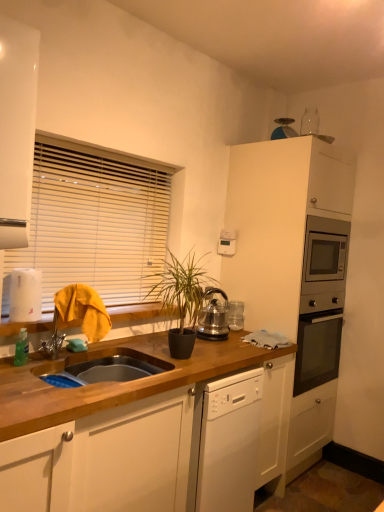
At what (x,y) coordinates should I click in order to perform the action: click on vacant space to the right of polished stainless steel kettle at center. Please return your answer as a coordinate pair (x, y). Looking at the image, I should click on (242, 336).